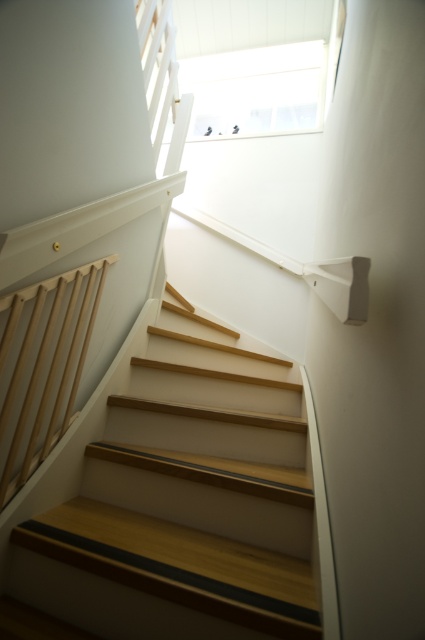
You are moving a large painting that is 2 meters wide. You need to carry it up the wooden stairs at center while holding onto the natural wood railing at left. Will the painting fit through the space between the stairs and the railing?

The wooden stairs at center has a larger size compared to natural wood railing at left. Since the stairs are larger, the space between them and the railing should accommodate the 2 meter wide painting.

You are standing at the bottom of the staircase and want to reach the window at the top. There are two points marked on the wall next to the stairs. Which point, point (x=240, y=477) or point (x=11, y=305), is closer to you as you look up towards the window?

Point (x=11, y=305) is closer to you because it is positioned closer to the bottom of the staircase, whereas point (x=240, y=477) is further away towards the top near the window.